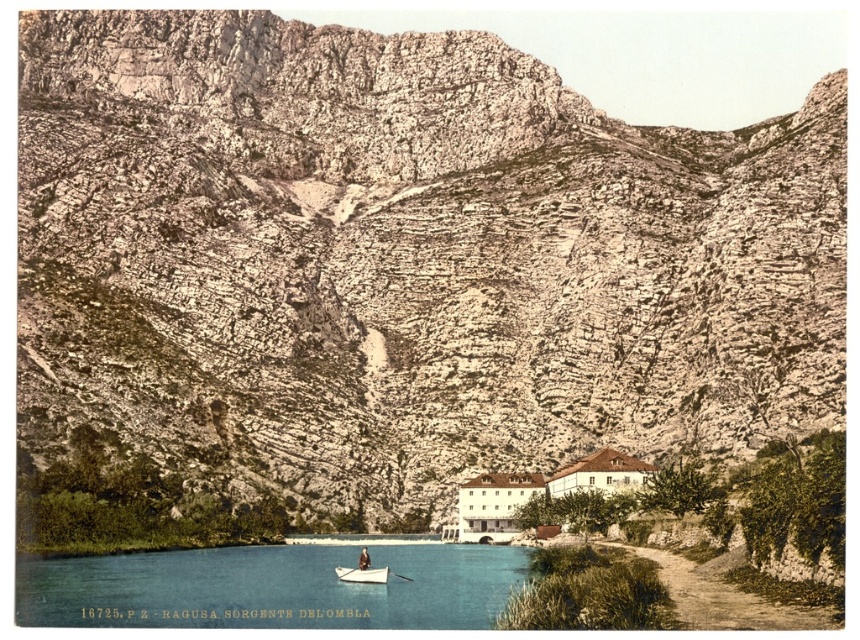
Question: Does blue glassy river at lower center appear on the right side of white matte boat at lower center?

Choices:
 (A) yes
 (B) no

Answer: (B)

Question: Among these points, which one is nearest to the camera?

Choices:
 (A) (364, 548)
 (B) (392, 572)

Answer: (B)

Question: Based on their relative distances, which object is farther from the white matte boat at lower center?

Choices:
 (A) dark brown leather jacket at center
 (B) white wood paddle at lower center
 (C) blue glassy river at lower center

Answer: (C)

Question: Can you confirm if blue glassy river at lower center is positioned below white matte boat at lower center?

Choices:
 (A) no
 (B) yes

Answer: (B)

Question: Considering the real-world distances, which object is farthest from the white wood paddle at lower center?

Choices:
 (A) white matte boat at lower center
 (B) blue glassy river at lower center

Answer: (B)

Question: Is white matte boat at lower center in front of dark brown leather jacket at center?

Choices:
 (A) yes
 (B) no

Answer: (A)